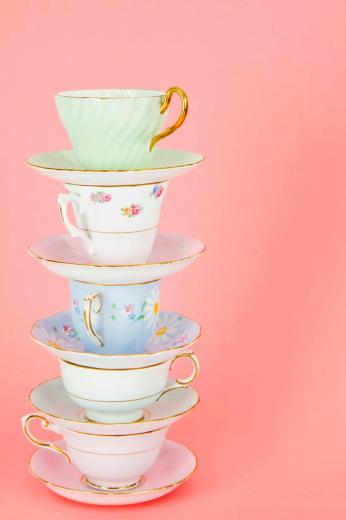
The height and width of the screenshot is (520, 346). Identify the location of pink china. (175, 463), (129, 459).